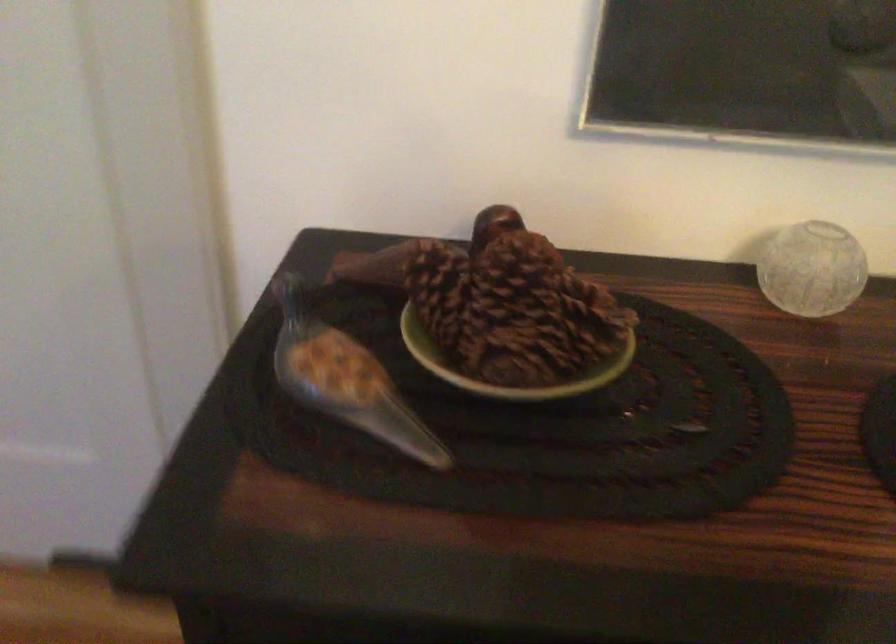
Where would you lift the glass bird figurine? Please return your answer as a coordinate pair (x, y).

(347, 386)